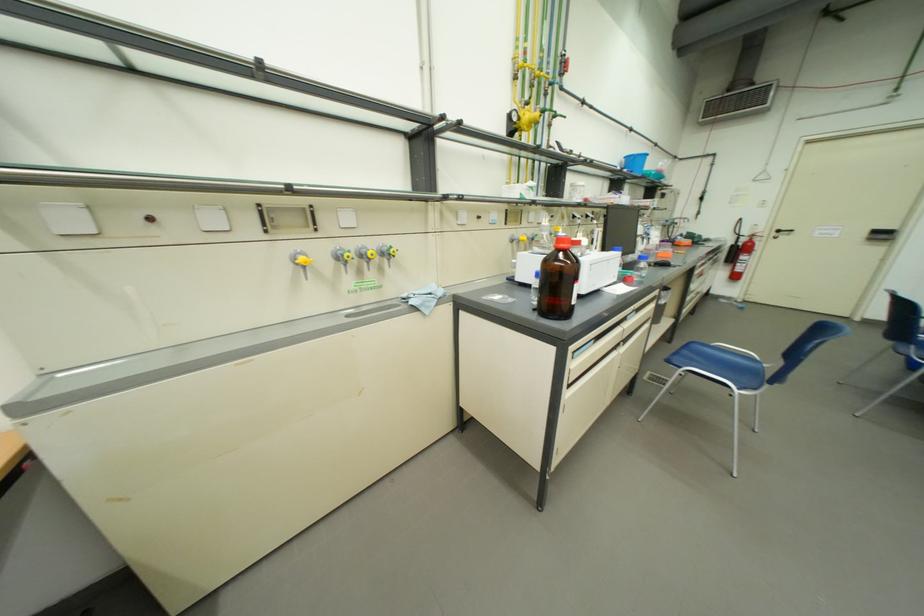
Where would you turn the black door handle? Please return your answer as a coordinate pair (x, y).

(782, 232)